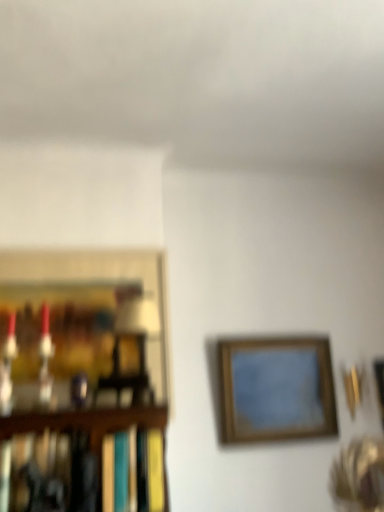
Question: Is hardcover book at left bigger than wooden framed picture at center, which is the second picture frame from right to left?

Choices:
 (A) no
 (B) yes

Answer: (B)

Question: Is hardcover book at left outside of wooden framed picture at center, which appears as the 2th picture frame when viewed from the left?

Choices:
 (A) no
 (B) yes

Answer: (B)

Question: Considering the relative sizes of hardcover book at left and wooden framed picture at center, which appears as the 2th picture frame when viewed from the left, in the image provided, is hardcover book at left wider than wooden framed picture at center, which appears as the 2th picture frame when viewed from the left,?

Choices:
 (A) yes
 (B) no

Answer: (A)

Question: Is hardcover book at left at the right side of wooden framed picture at center, which is the second picture frame from right to left?

Choices:
 (A) no
 (B) yes

Answer: (A)

Question: Could you tell me if hardcover book at left is facing wooden framed picture at center, which appears as the 2th picture frame when viewed from the left?

Choices:
 (A) no
 (B) yes

Answer: (A)

Question: From a real-world perspective, does hardcover book at left stand above wooden framed picture at center, which is the second picture frame from right to left?

Choices:
 (A) yes
 (B) no

Answer: (B)

Question: Is wooden picture frame at left, which ranks as the 1th picture frame in left-to-right order, with wooden frame at upper right, the first picture frame when ordered from right to left?

Choices:
 (A) yes
 (B) no

Answer: (B)

Question: Is wooden picture frame at left, which is counted as the 3th picture frame, starting from the right, aimed at wooden frame at upper right, the third picture frame viewed from the left?

Choices:
 (A) yes
 (B) no

Answer: (B)

Question: Is wooden picture frame at left, which ranks as the 1th picture frame in left-to-right order, smaller than wooden frame at upper right, the third picture frame viewed from the left?

Choices:
 (A) yes
 (B) no

Answer: (B)

Question: Considering the relative sizes of wooden picture frame at left, which ranks as the 1th picture frame in left-to-right order, and wooden frame at upper right, the first picture frame when ordered from right to left, in the image provided, is wooden picture frame at left, which ranks as the 1th picture frame in left-to-right order, bigger than wooden frame at upper right, the first picture frame when ordered from right to left,?

Choices:
 (A) no
 (B) yes

Answer: (B)

Question: Considering the relative sizes of wooden picture frame at left, which is counted as the 3th picture frame, starting from the right, and wooden frame at upper right, the first picture frame when ordered from right to left, in the image provided, is wooden picture frame at left, which is counted as the 3th picture frame, starting from the right, shorter than wooden frame at upper right, the first picture frame when ordered from right to left,?

Choices:
 (A) yes
 (B) no

Answer: (B)

Question: From a real-world perspective, is wooden picture frame at left, which ranks as the 1th picture frame in left-to-right order, on wooden frame at upper right, the first picture frame when ordered from right to left?

Choices:
 (A) yes
 (B) no

Answer: (A)

Question: Can you confirm if wooden frame at upper right, the first picture frame when ordered from right to left, is taller than wooden framed picture at center, which appears as the 2th picture frame when viewed from the left?

Choices:
 (A) yes
 (B) no

Answer: (B)